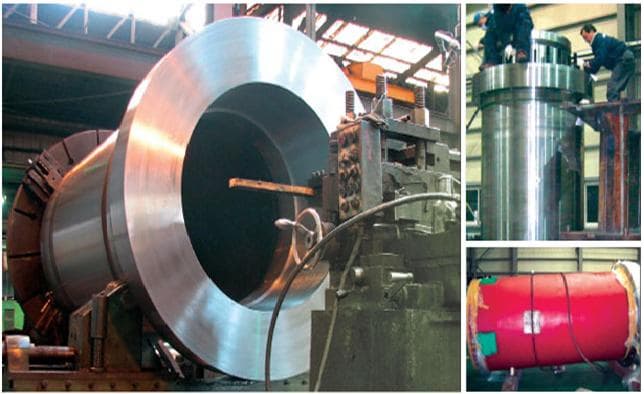
Find the location of a particular element. The image size is (644, 394). handle is located at coordinates (289, 221).